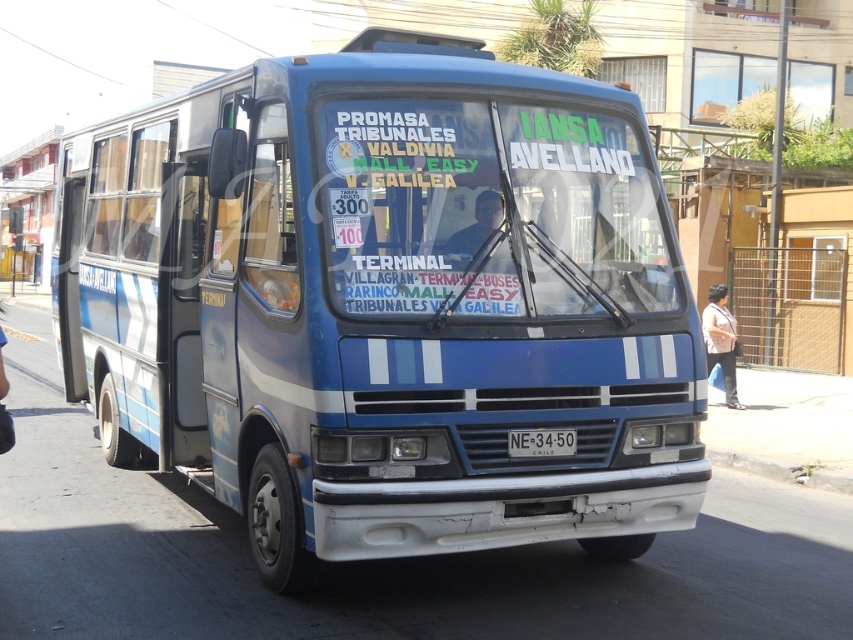
You are a pedestrian standing on the sidewalk next to the blue matte bus at center and the white plastic license plate at center. Which object is closer to the left side of the street?

The blue matte bus at center is positioned on the left side of the white plastic license plate at center, so it is closer to the left side of the street.

You are a delivery person trying to attach a small package to the white plastic license plate at center of the blue matte bus at center. Considering their sizes, will the package fit without overlapping onto the bus body?

The blue matte bus at center is bigger than the white plastic license plate at center. Since the license plate is smaller, the package may not fit without overlapping if it exceeds the plate size.

Based on the photo, where is the blue matte bus at center located in the image?

The blue matte bus at center is located at point [387,304].